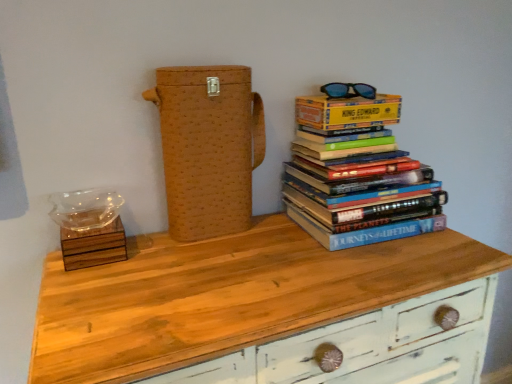
The height and width of the screenshot is (384, 512). I want to click on free space above yellow paper at upper right (from a real-world perspective), so click(338, 88).